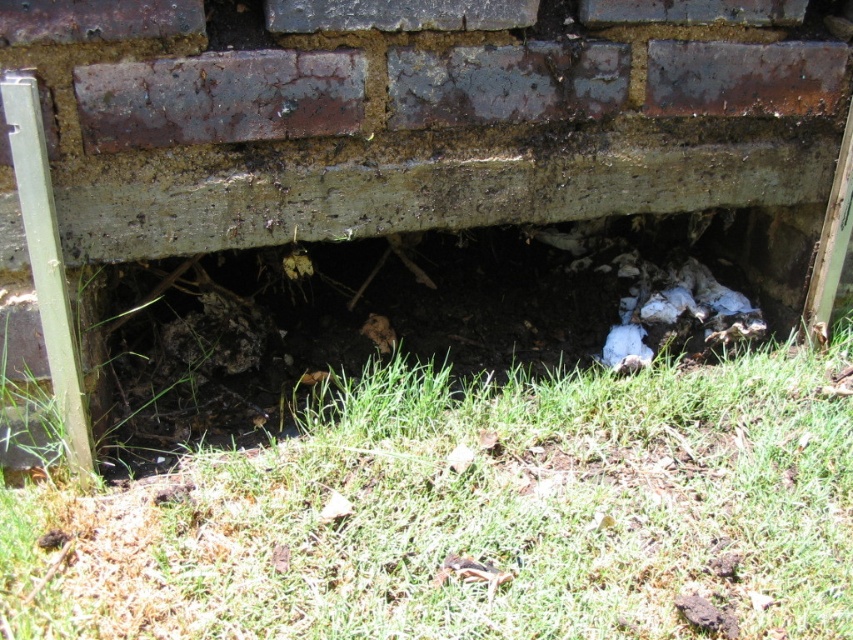
Who is positioned more to the right, green grass at lower center or dull concrete hole at center?

Positioned to the right is green grass at lower center.

From the picture: Is green grass at lower center further to camera compared to dull concrete hole at center?

That is False.

Who is more forward, (373, 500) or (426, 244)?

Positioned in front is point (373, 500).

This screenshot has height=640, width=853. What are the coordinates of `green grass at lower center` in the screenshot? It's located at (476, 515).